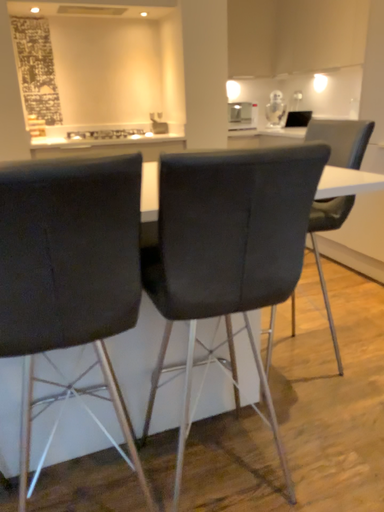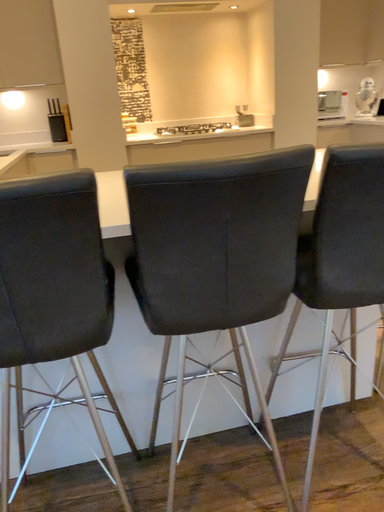
Question: How did the camera likely rotate when shooting the video?

Choices:
 (A) rotated right
 (B) rotated left

Answer: (B)